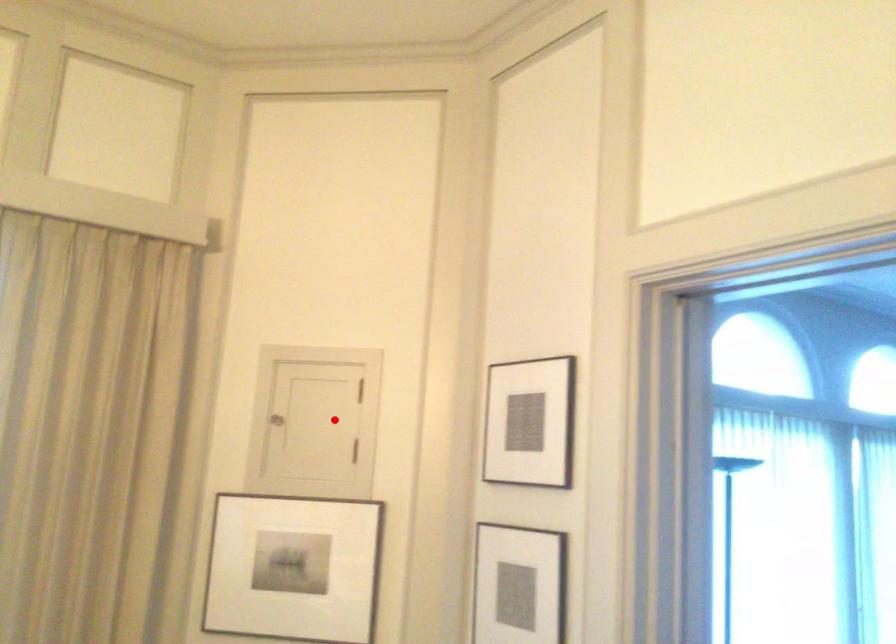
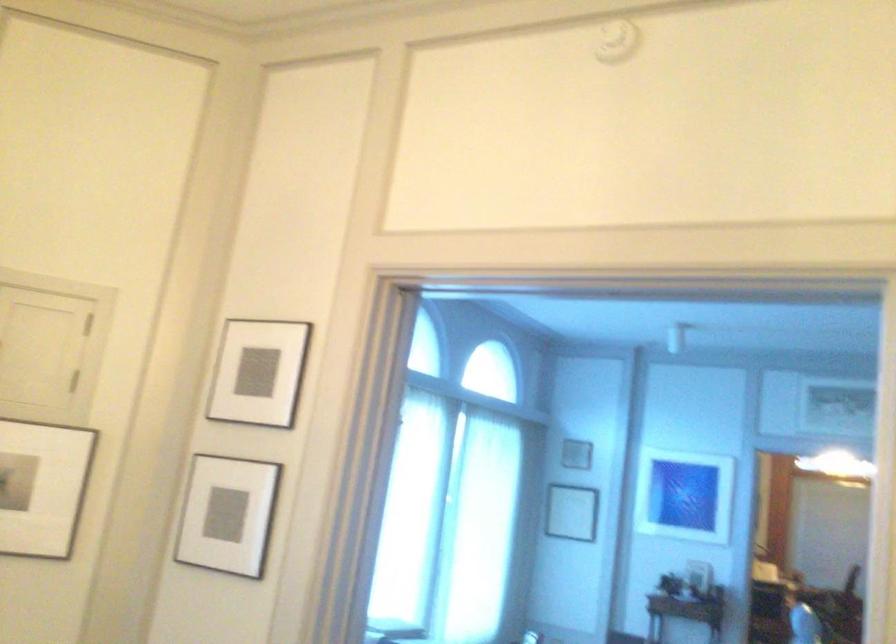
In the second image, find the point that corresponds to the highlighted location in the first image.

(49, 346)